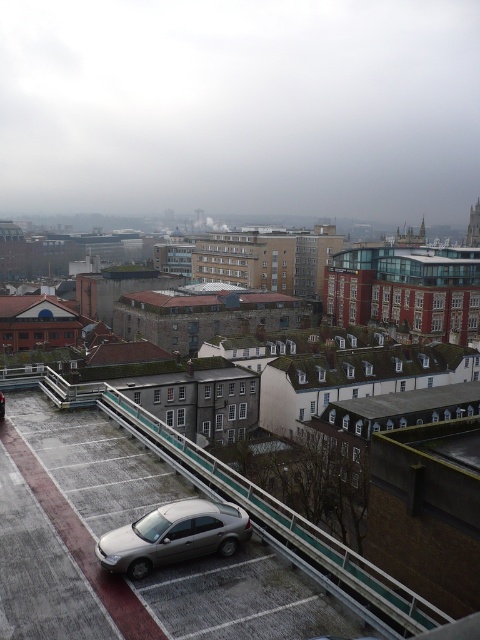
Question: Does metallic silver car at lower left have a smaller size compared to satin silver sedan at lower center?

Choices:
 (A) yes
 (B) no

Answer: (B)

Question: Among these objects, which one is nearest to the camera?

Choices:
 (A) metallic silver car at lower left
 (B) satin silver sedan at lower center

Answer: (A)

Question: Is metallic silver car at lower left wider than satin silver sedan at lower center?

Choices:
 (A) yes
 (B) no

Answer: (A)

Question: Is metallic silver car at lower left further to the viewer compared to satin silver sedan at lower center?

Choices:
 (A) no
 (B) yes

Answer: (A)